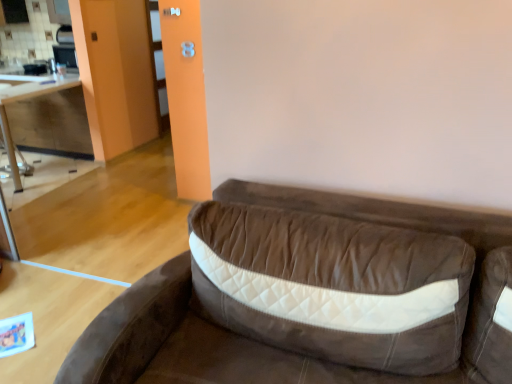
You are a GUI agent. You are given a task and a screenshot of the screen. Output one action in this format:
    pyautogui.click(x=<x>, y=<y>)
    Task: Click on the wooden table at left
    The width and height of the screenshot is (512, 384).
    Given the screenshot: What is the action you would take?
    pyautogui.click(x=23, y=100)

This screenshot has height=384, width=512. What are the coordinates of `brown suede studio couch at center` in the screenshot? It's located at (130, 328).

In the scene shown: Does brown suede studio couch at center lie in front of wooden cabinet at left?

Yes, it is.

Is brown suede studio couch at center spatially inside wooden cabinet at left, or outside of it?

brown suede studio couch at center is located beyond the bounds of wooden cabinet at left.

From a real-world perspective, is brown suede studio couch at center under wooden cabinet at left?

Indeed, from a real-world perspective, brown suede studio couch at center is positioned beneath wooden cabinet at left.

Is point (322, 206) in front of point (55, 138)?

Yes.

Considering the relative sizes of wooden cabinet at left and brown suede studio couch at center in the image provided, is wooden cabinet at left taller than brown suede studio couch at center?

No, wooden cabinet at left is not taller than brown suede studio couch at center.

Are wooden cabinet at left and brown suede studio couch at center located far from each other?

wooden cabinet at left is positioned a significant distance from brown suede studio couch at center.

Which is more to the left, wooden cabinet at left or brown suede studio couch at center?

Positioned to the left is wooden cabinet at left.

Does wooden cabinet at left have a lesser width compared to brown suede studio couch at center?

Indeed, wooden cabinet at left has a lesser width compared to brown suede studio couch at center.

Image resolution: width=512 pixels, height=384 pixels. Identify the location of table below the wooden cabinet at left (from a real-world perspective). (23, 100).

Considering the sizes of objects wooden table at left and wooden cabinet at left in the image provided, who is thinner, wooden table at left or wooden cabinet at left?

With smaller width is wooden table at left.

Does wooden table at left lie in front of wooden cabinet at left?

Yes, it is.

Is wooden table at left beside wooden cabinet at left?

No, wooden table at left is not touching wooden cabinet at left.

Is wooden cabinet at left smaller than wooden table at left?

No, wooden cabinet at left is not smaller than wooden table at left.

From the image's perspective, which one is positioned higher, wooden cabinet at left or wooden table at left?

From the image's view, wooden cabinet at left is above.

Considering the points (42, 140) and (42, 89), which point is in front, point (42, 140) or point (42, 89)?

The point (42, 89) is closer to the camera.

In the scene shown: Could you tell me if wooden table at left is turned towards brown suede studio couch at center?

No, wooden table at left is not aimed at brown suede studio couch at center.

Considering the relative sizes of wooden table at left and brown suede studio couch at center in the image provided, is wooden table at left thinner than brown suede studio couch at center?

Yes, wooden table at left is thinner than brown suede studio couch at center.

Consider the image. Considering the relative positions of wooden table at left and brown suede studio couch at center in the image provided, is wooden table at left to the left of brown suede studio couch at center from the viewer's perspective?

Yes.

Can you tell me how much wooden table at left and brown suede studio couch at center differ in facing direction?

The angle between the facing direction of wooden table at left and the facing direction of brown suede studio couch at center is 90.4 degrees.

Which of these two, brown suede studio couch at center or wooden table at left, is smaller?

With smaller size is wooden table at left.

Can you confirm if brown suede studio couch at center is positioned to the right of wooden table at left?

Yes, brown suede studio couch at center is to the right of wooden table at left.

From the image's perspective, is brown suede studio couch at center located beneath wooden table at left?

Correct, brown suede studio couch at center appears lower than wooden table at left in the image.

Locate an element on the screen. studio couch below the wooden cabinet at left (from a real-world perspective) is located at coordinates (130, 328).

Locate an element on the screen. This screenshot has width=512, height=384. studio couch below the wooden cabinet at left (from the image's perspective) is located at coordinates (130, 328).

Which object lies further to the anchor point brown suede studio couch at center, wooden cabinet at left or wooden table at left?

wooden table at left lies further to brown suede studio couch at center than the other object.

Looking at the image, which one is located further to wooden cabinet at left, wooden table at left or brown suede studio couch at center?

The object further to wooden cabinet at left is brown suede studio couch at center.

From the image, which object appears to be farther from wooden table at left, wooden cabinet at left or brown suede studio couch at center?

brown suede studio couch at center.

In the scene shown: Looking at the image, which one is located closer to wooden cabinet at left, brown suede studio couch at center or wooden table at left?

wooden table at left lies closer to wooden cabinet at left than the other object.

Considering their positions, is wooden table at left positioned further to brown suede studio couch at center than wooden cabinet at left?

wooden table at left.

Looking at the image, which one is located closer to wooden table at left, brown suede studio couch at center or wooden cabinet at left?

Among the two, wooden cabinet at left is located nearer to wooden table at left.

At what (x,y) coordinates should I click in order to perform the action: click on table positioned between brown suede studio couch at center and wooden cabinet at left from near to far. Please return your answer as a coordinate pair (x, y). This screenshot has width=512, height=384. Looking at the image, I should click on (23, 100).